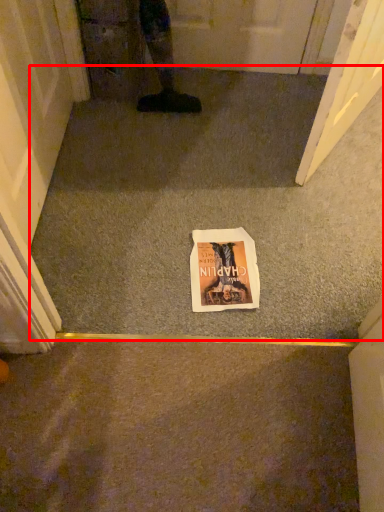
Question: From the image's perspective, where is concrete (annotated by the red box) located relative to comic book?

Choices:
 (A) above
 (B) below

Answer: (A)